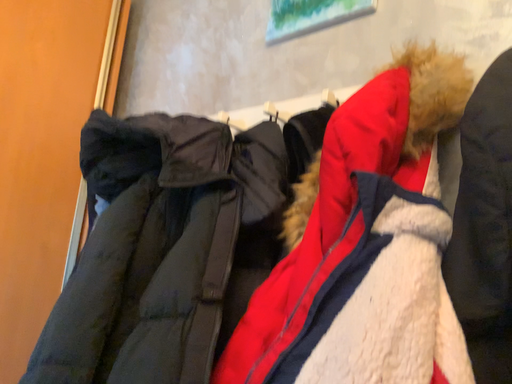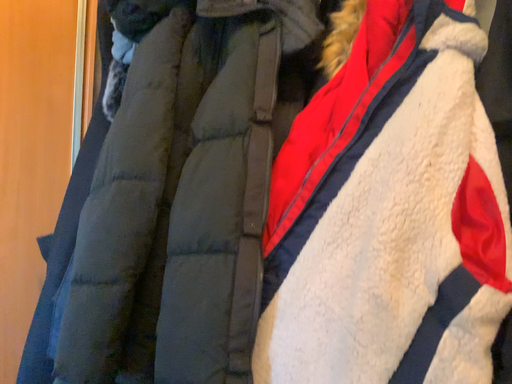
Question: How did the camera likely rotate when shooting the video?

Choices:
 (A) rotated downward
 (B) rotated upward

Answer: (A)